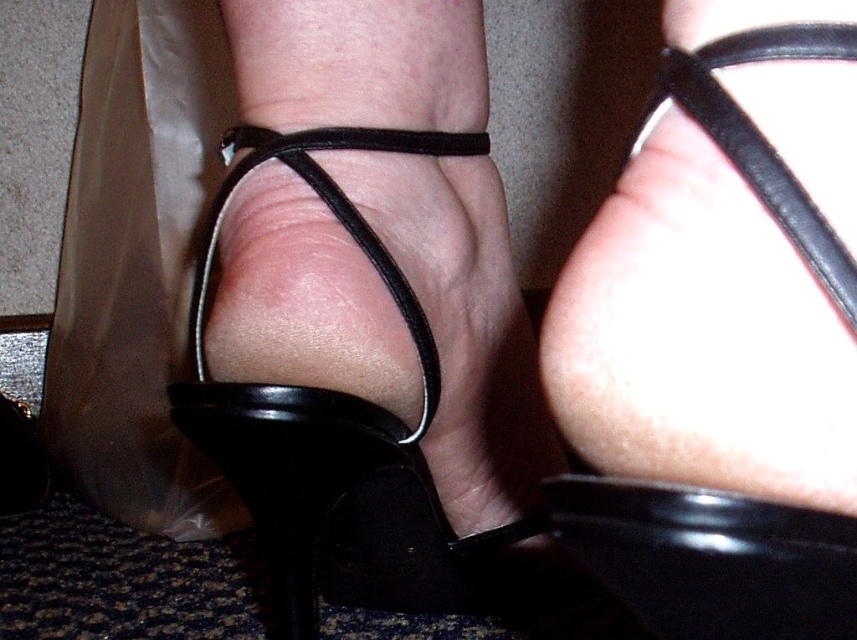
Question: Is black suede sandal at center smaller than black leather sandal at center?

Choices:
 (A) no
 (B) yes

Answer: (A)

Question: Which point is farther from the camera taking this photo?

Choices:
 (A) (714, 125)
 (B) (288, 600)
 (C) (630, 148)

Answer: (B)

Question: Which object is closer to the camera taking this photo?

Choices:
 (A) black leather sandal at center
 (B) black suede sandal at center
 (C) black leather strap at upper right

Answer: (C)

Question: Observing the image, what is the correct spatial positioning of black suede sandal at center in reference to black leather sandal at center?

Choices:
 (A) right
 (B) left

Answer: (B)

Question: Which object appears farthest from the camera in this image?

Choices:
 (A) black suede sandal at center
 (B) black leather sandal at center
 (C) black leather strap at upper right

Answer: (A)

Question: Does black leather sandal at center have a larger size compared to black leather strap at upper right?

Choices:
 (A) no
 (B) yes

Answer: (B)